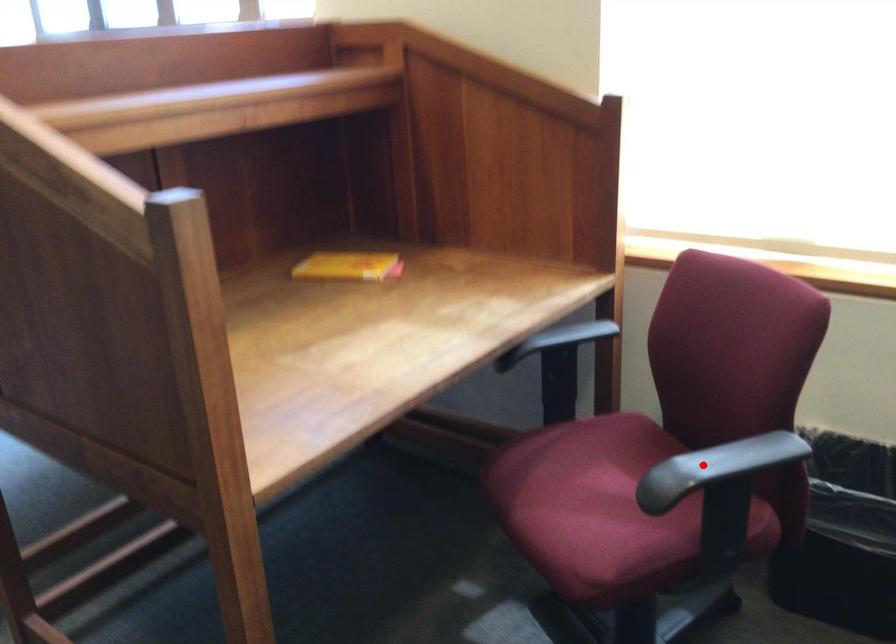
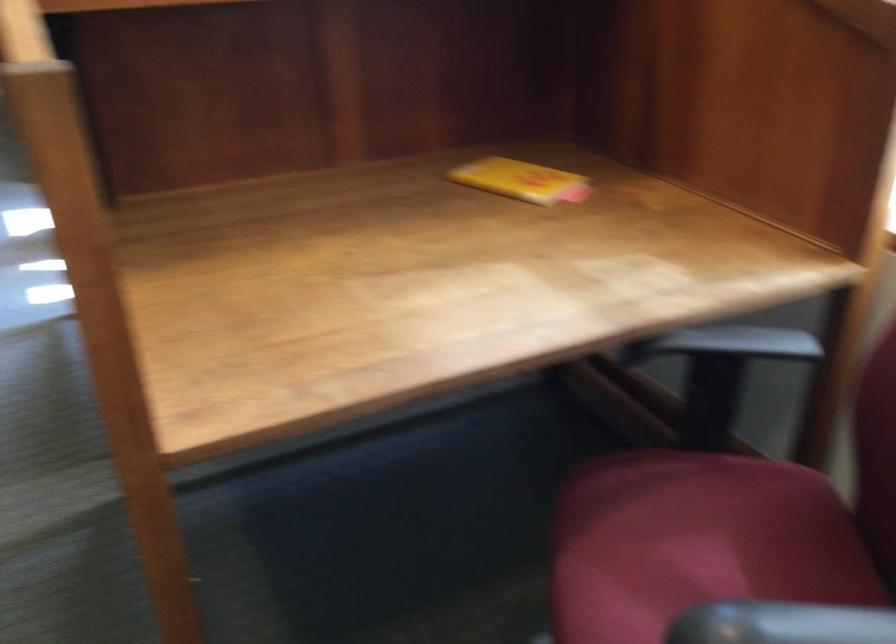
Where in the second image is the point corresponding to the highlighted location from the first image?

(780, 623)